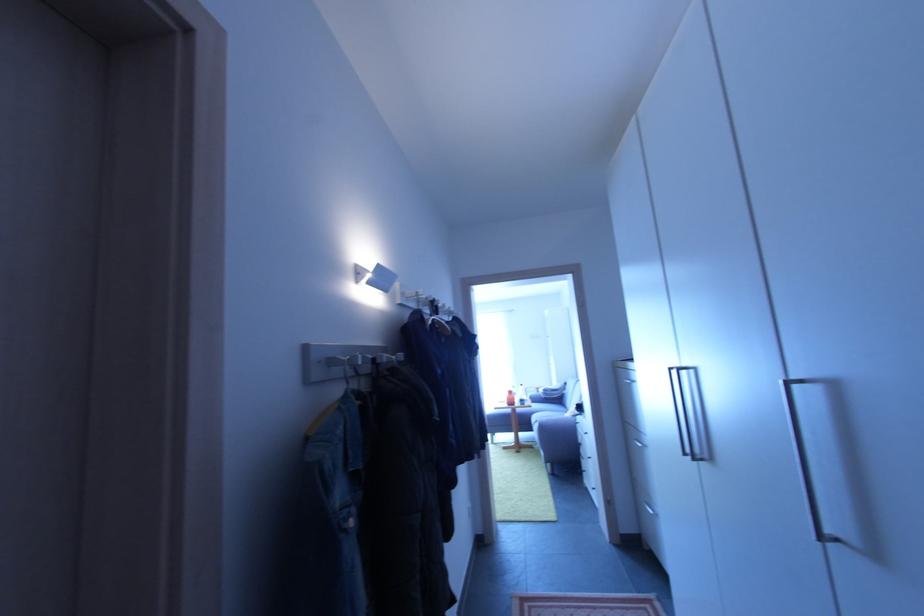
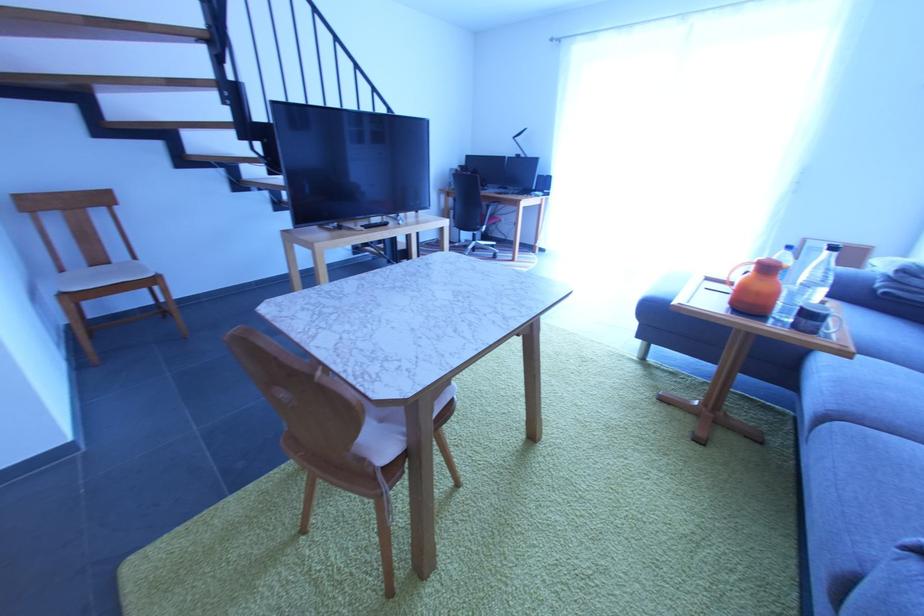
Where in the second image is the point corresponding to [540,426] from the first image?

(833, 419)